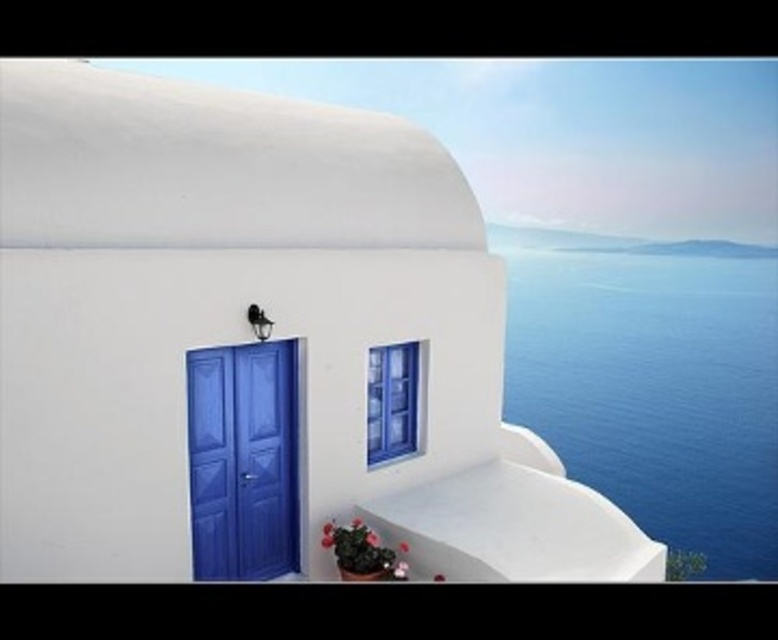
You are a painter who wants to paint both the matte blue door at lower left and the blue glass window at center. Since you need to know which requires more paint, can you tell me which is larger?

The matte blue door at lower left is bigger than the blue glass window at center, so it requires more paint.

You are an architect designing a new building inspired by this Mediterranean style. You need to ensure that the door and window dimensions align with the original design. Which object, the matte blue door at lower left or the blue glass window at center, should be taller in your design?

The matte blue door at lower left should be taller than the blue glass window at center in your design, as it has a greater height compared to the blue glass window at center according to the original scene.